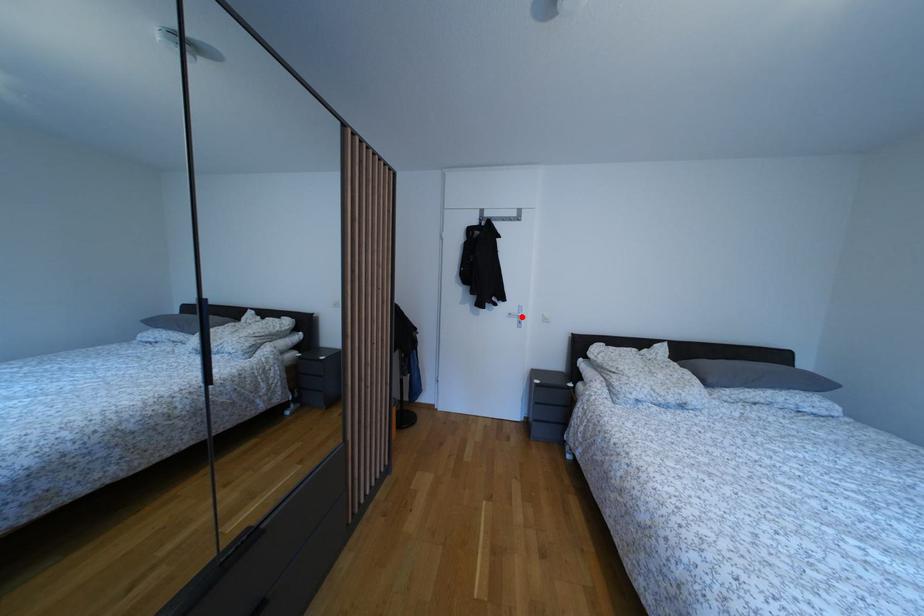
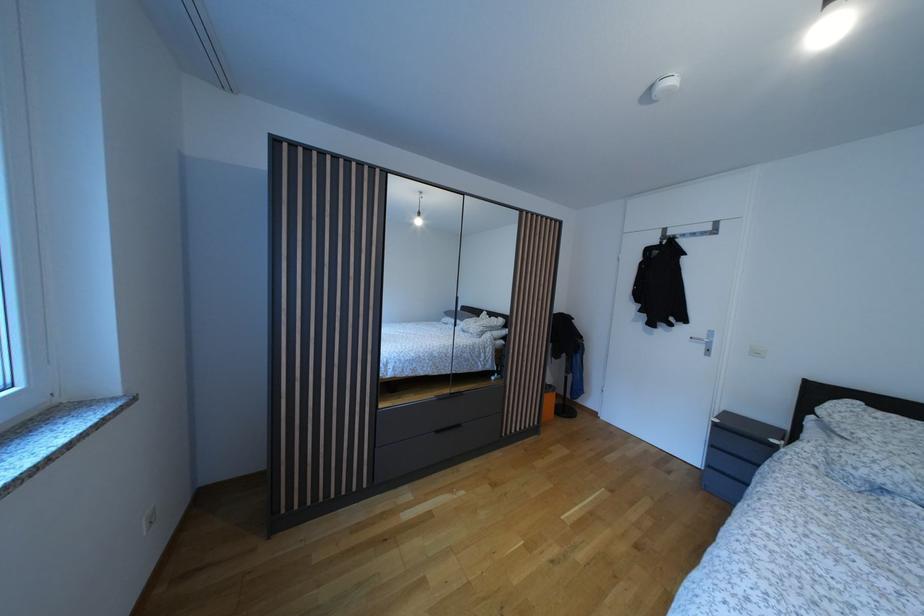
Find the pixel in the second image that matches the highlighted location in the first image.

(709, 342)